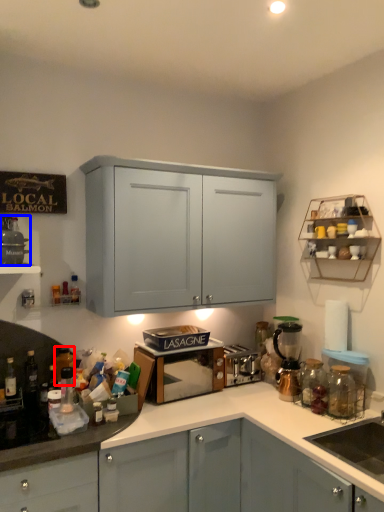
Question: Which point is further to the camera, bottle (highlighted by a red box) or appliance (highlighted by a blue box)?

Choices:
 (A) bottle
 (B) appliance

Answer: (A)